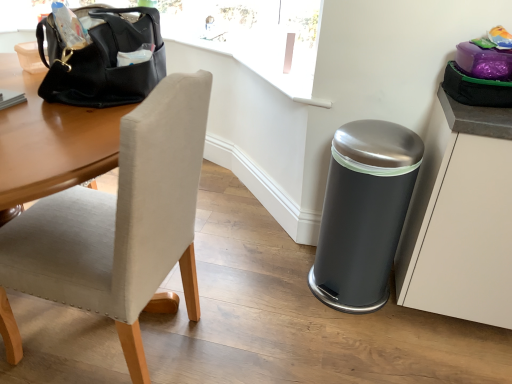
Question: Is black leather handbag at upper left inside white matte cabinet at right?

Choices:
 (A) no
 (B) yes

Answer: (A)

Question: From a real-world perspective, does white matte cabinet at right sit lower than black leather handbag at upper left?

Choices:
 (A) no
 (B) yes

Answer: (B)

Question: Is white matte cabinet at right in front of black leather handbag at upper left?

Choices:
 (A) yes
 (B) no

Answer: (B)

Question: Is white matte cabinet at right bigger than black leather handbag at upper left?

Choices:
 (A) no
 (B) yes

Answer: (B)

Question: Can you confirm if white matte cabinet at right is positioned to the left of black leather handbag at upper left?

Choices:
 (A) no
 (B) yes

Answer: (A)

Question: Is white matte cabinet at right thinner than black leather handbag at upper left?

Choices:
 (A) no
 (B) yes

Answer: (A)

Question: Can you confirm if black leather handbag at upper left is positioned to the right of satin silver trash can at lower right?

Choices:
 (A) no
 (B) yes

Answer: (A)

Question: Considering the relative sizes of black leather handbag at upper left and satin silver trash can at lower right in the image provided, is black leather handbag at upper left thinner than satin silver trash can at lower right?

Choices:
 (A) no
 (B) yes

Answer: (B)

Question: Considering the relative positions of black leather handbag at upper left and satin silver trash can at lower right in the image provided, is black leather handbag at upper left to the left of satin silver trash can at lower right from the viewer's perspective?

Choices:
 (A) no
 (B) yes

Answer: (B)

Question: Does black leather handbag at upper left lie behind satin silver trash can at lower right?

Choices:
 (A) yes
 (B) no

Answer: (B)

Question: From a real-world perspective, does black leather handbag at upper left sit lower than satin silver trash can at lower right?

Choices:
 (A) no
 (B) yes

Answer: (A)

Question: Is black leather handbag at upper left not inside satin silver trash can at lower right?

Choices:
 (A) yes
 (B) no

Answer: (A)

Question: From a real-world perspective, is satin silver trash can at lower right positioned over white matte cabinet at right based on gravity?

Choices:
 (A) yes
 (B) no

Answer: (B)